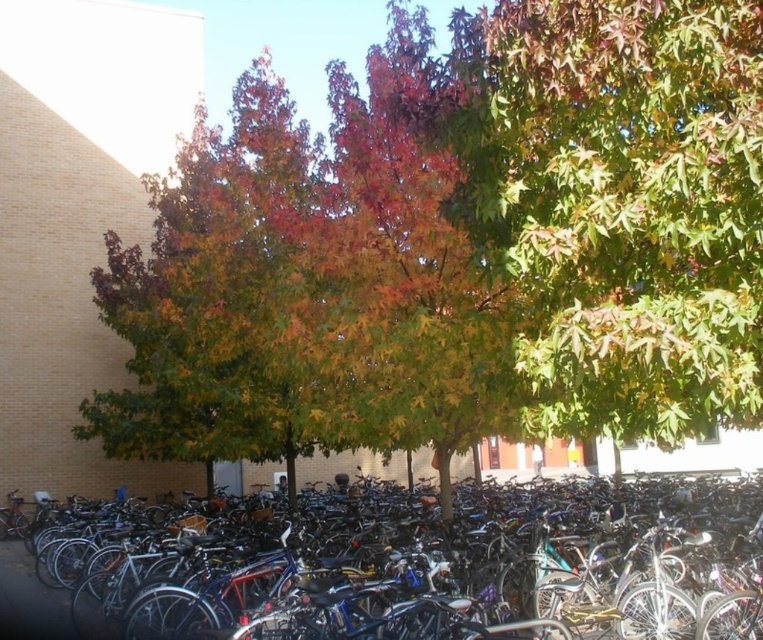
You are a gardener looking at the bike parking area. You notice the multicolored foliage at center and the green matte tree at center. Which one is positioned to the left when viewed from the front?

The multicolored foliage at center is to the left of the green matte tree at center, so it is positioned to the left when viewed from the front.